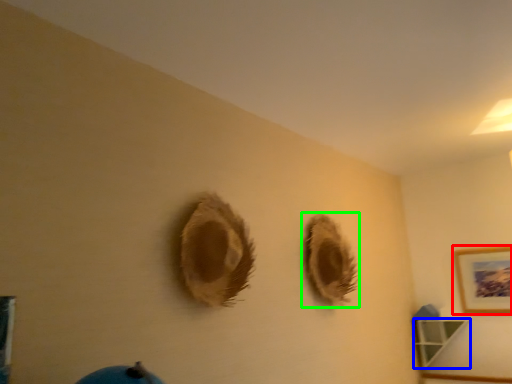
Question: Which object is the farthest from picture frame (highlighted by a red box)? Choose among these: shelf (highlighted by a blue box) or hole (highlighted by a green box).

Choices:
 (A) shelf
 (B) hole

Answer: (B)